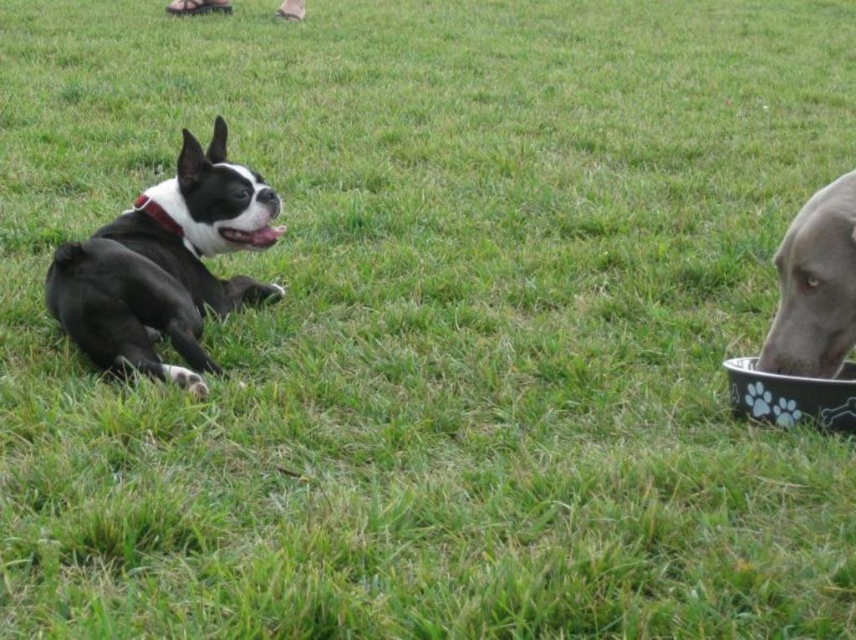
You are a dog trainer observing two dogs in a grassy field. You notice a point at coordinates (x=815, y=285). Which object from the scene is this point located on?

The point at coordinates (x=815, y=285) is located on the gray matte bowl at right.

You are a dog owner who wants to ensure your pets have enough space to move around. Based on the scene, can the black glossy dog at left comfortably stand up without hitting its head on the gray matte bowl at right?

The black glossy dog at left is taller than the gray matte bowl at right, so if the dog stands up, its height would exceed the bowl, meaning it might hit its head. Therefore, the dog cannot comfortably stand up without risking contact with the bowl.

You are a dog owner who wants to feed your dog. You have a black glossy dog at left and a black plastic bowl at right. Which direction should you move the bowl to so the dog can reach it more easily?

Since the black glossy dog at left is to the left of the black plastic bowl at right, you should move the bowl to the left to make it easier for the dog to reach it.